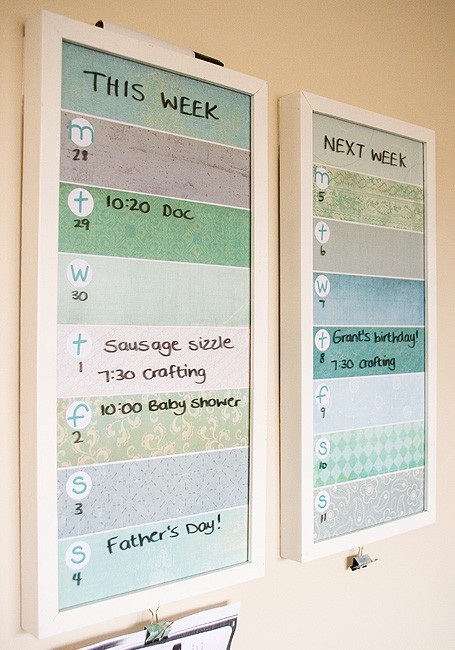
Locate an element on the screen. Image resolution: width=455 pixels, height=650 pixels. marker is located at coordinates (121, 26).